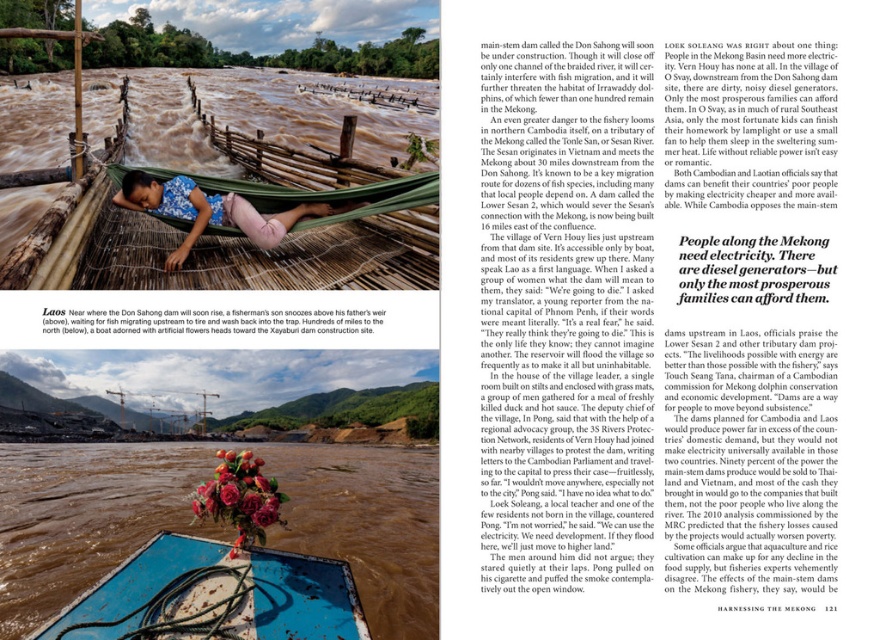
Is point (308, 518) in front of point (209, 624)?

No.

Does brown rubber boat at lower center have a smaller size compared to blue rubber boat at lower center?

No.

Which is behind, point (401, 554) or point (243, 596)?

Point (401, 554)

Where is `brown rubber boat at lower center`? brown rubber boat at lower center is located at coordinates (83, 515).

Does blue rubber boat at lower center appear over floral fabric hammock at center?

Incorrect, blue rubber boat at lower center is not positioned above floral fabric hammock at center.

Is blue rubber boat at lower center to the left of floral fabric hammock at center from the viewer's perspective?

Incorrect, blue rubber boat at lower center is not on the left side of floral fabric hammock at center.

Between point (187, 554) and point (167, 260), which one is positioned in front?

Point (187, 554) is more forward.

What are the coordinates of `blue rubber boat at lower center` in the screenshot? It's located at (214, 595).

Who is positioned more to the left, brown rubber boat at lower center or floral fabric hammock at center?

brown rubber boat at lower center is more to the left.

Can you confirm if brown rubber boat at lower center is positioned to the right of floral fabric hammock at center?

In fact, brown rubber boat at lower center is to the left of floral fabric hammock at center.

Which is in front, point (324, 472) or point (342, 209)?

Point (342, 209) is in front.

Image resolution: width=880 pixels, height=640 pixels. I want to click on brown rubber boat at lower center, so click(x=83, y=515).